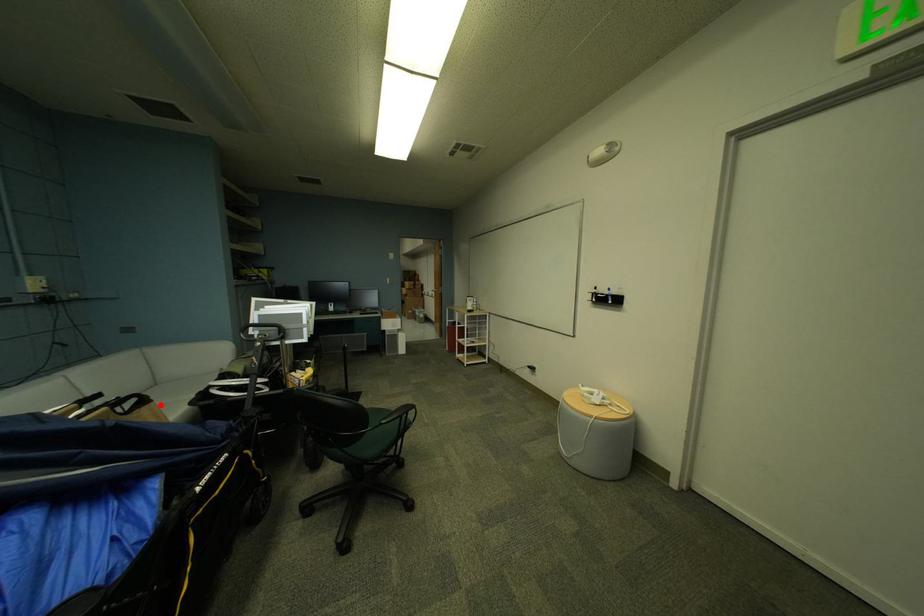
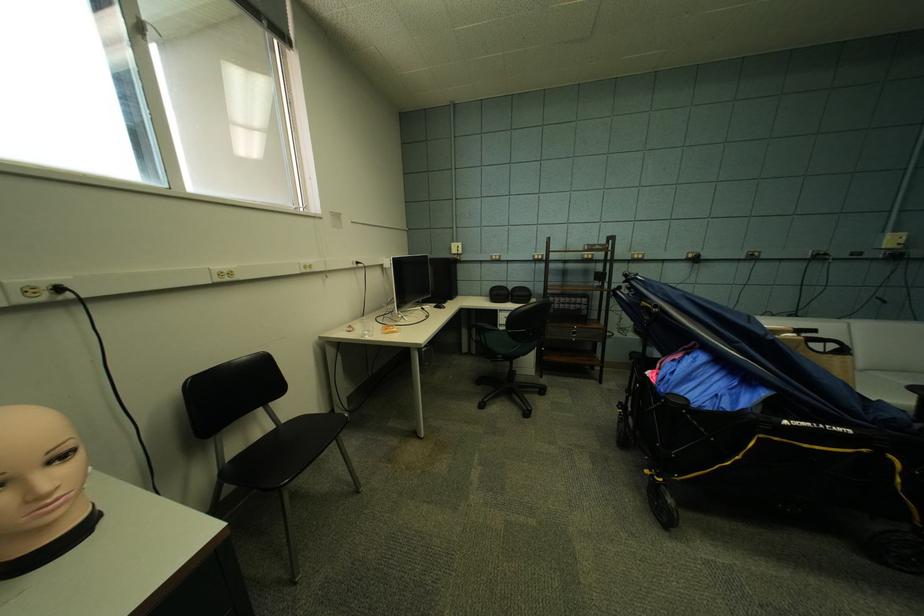
Question: I am providing you with two images of the same scene from different viewpoints. In image1, a red point is highlighted. Considering the same 3D point in image2, which of the following is correct?

Choices:
 (A) It is closer
 (B) It is farther

Answer: (A)